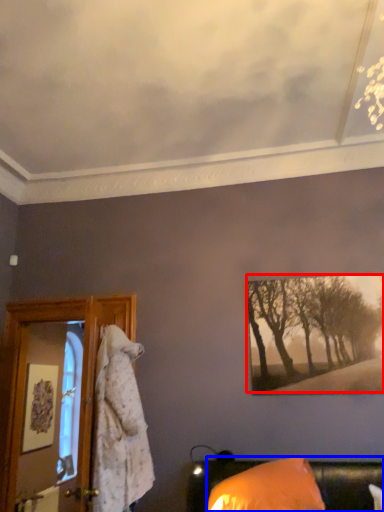
Question: Which point is closer to the camera, tree (highlighted by a red box) or furniture (highlighted by a blue box)?

Choices:
 (A) tree
 (B) furniture

Answer: (B)